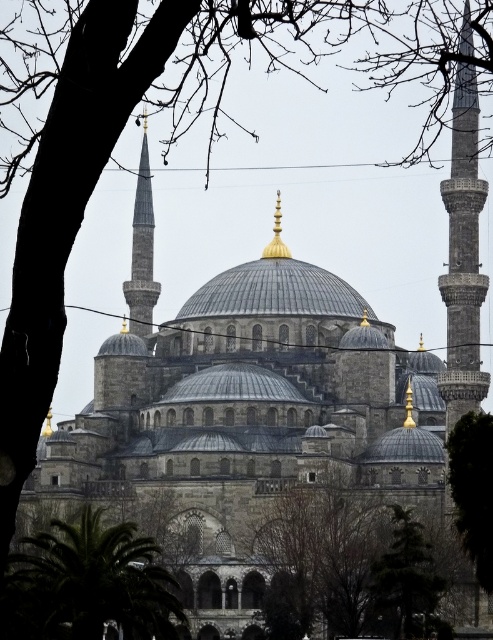
Between green leafy tree at lower left and gray stone minaret at right, which one appears on the left side from the viewer's perspective?

Positioned to the left is green leafy tree at lower left.

Does green leafy tree at lower left appear under gray stone minaret at right?

Indeed, green leafy tree at lower left is positioned under gray stone minaret at right.

Does point (29, 541) come in front of point (461, 301)?

That is True.

This screenshot has height=640, width=493. I want to click on green leafy tree at lower left, so click(86, 584).

Who is more forward, (2,618) or (143,294)?

Point (2,618) is more forward.

Does point (139, 600) come farther from viewer compared to point (140, 236)?

No, it is not.

The width and height of the screenshot is (493, 640). Describe the element at coordinates (86, 584) in the screenshot. I see `green leafy tree at lower left` at that location.

The height and width of the screenshot is (640, 493). I want to click on green leafy tree at lower left, so click(x=86, y=584).

How far apart are green leafy tree at lower left and green leafy tree at lower right?

19.26 meters

Is green leafy tree at lower left further to camera compared to green leafy tree at lower right?

That is False.

Between point (68, 580) and point (490, 442), which one is positioned in front?

Point (68, 580) is in front.

Locate an element on the screen. Image resolution: width=493 pixels, height=640 pixels. green leafy tree at lower left is located at coordinates (86, 584).